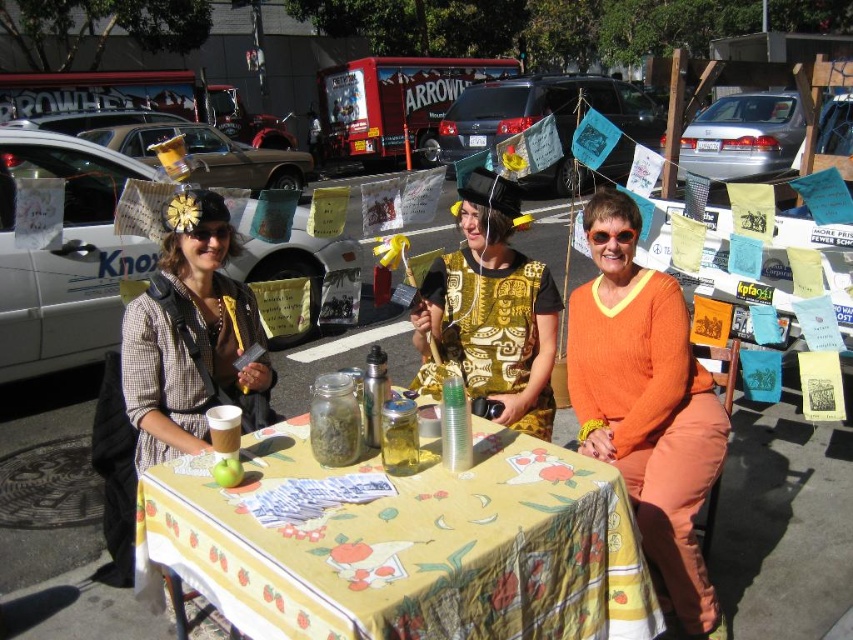
Question: From the image, what is the correct spatial relationship of metallic silver thermos at table center in relation to matte plastic cup at table center?

Choices:
 (A) below
 (B) above

Answer: (B)

Question: Does yellow printed fabric table at center appear on the left side of green matte apple at center?

Choices:
 (A) yes
 (B) no

Answer: (B)

Question: Estimate the real-world distances between objects in this image. Which object is farther from the yellow printed fabric table at center?

Choices:
 (A) green matte apple at center
 (B) matte plastic cup at table center
 (C) plaid fabric jacket at center

Answer: (C)

Question: Does clear glass jar at table center have a lesser width compared to translucent glass jar at table center?

Choices:
 (A) yes
 (B) no

Answer: (B)

Question: Among these points, which one is farthest from the camera?

Choices:
 (A) (299, 618)
 (B) (219, 419)

Answer: (B)

Question: Which object is closer to the camera taking this photo?

Choices:
 (A) printed fabric shirt at center
 (B) green matte apple at center
 (C) plaid fabric jacket at center

Answer: (B)